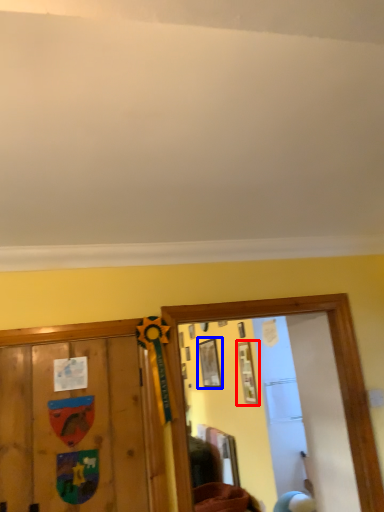
Question: Which of the following is the farthest to the observer, picture frame (highlighted by a red box) or picture frame (highlighted by a blue box)?

Choices:
 (A) picture frame
 (B) picture frame

Answer: (B)